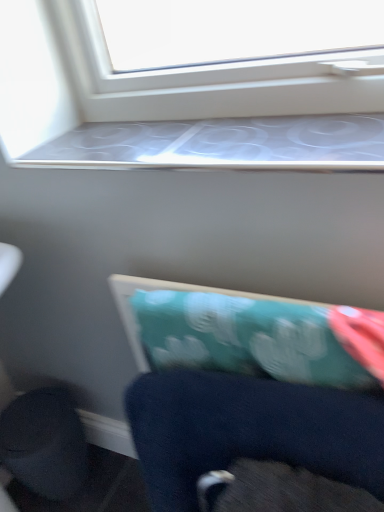
I want to click on teal fabric cushion at lower center, so click(153, 287).

Image resolution: width=384 pixels, height=512 pixels. Describe the element at coordinates (153, 287) in the screenshot. I see `teal fabric cushion at lower center` at that location.

At what (x,y) coordinates should I click in order to perform the action: click on teal fabric cushion at lower center. Please return your answer as a coordinate pair (x, y). Looking at the image, I should click on (153, 287).